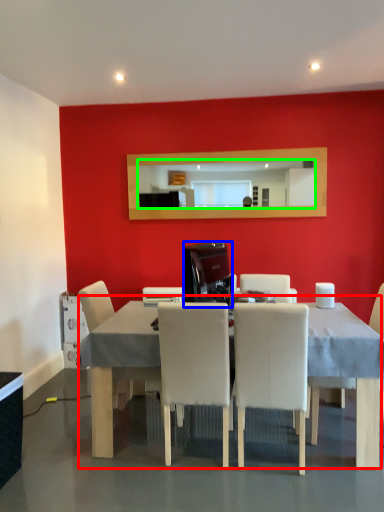
Question: Considering the real-world distances, which object is closest to table (highlighted by a red box)? appliance (highlighted by a blue box) or mirror (highlighted by a green box).

Choices:
 (A) appliance
 (B) mirror

Answer: (A)